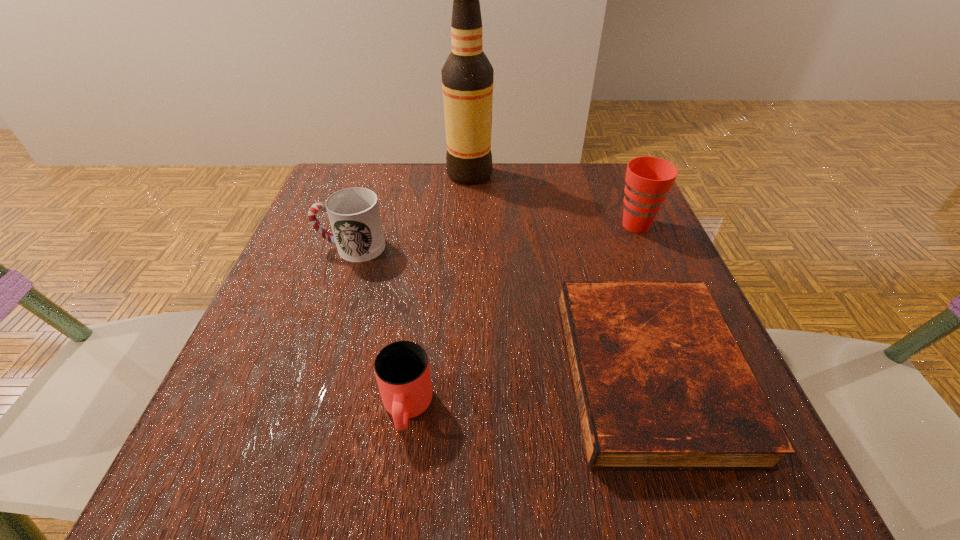
At what (x,y) coordinates should I click in order to perform the action: click on free space between the Bible and the farthest object. Please return your answer as a coordinate pair (x, y). Looking at the image, I should click on (560, 273).

Where is `empty space that is in between the fourth tallest object and the leftmost object`? This screenshot has height=540, width=960. empty space that is in between the fourth tallest object and the leftmost object is located at coordinates (379, 328).

What are the coordinates of `vacant point located between the rightmost cup and the second tallest cup` in the screenshot? It's located at (493, 236).

Identify the location of vacant point located between the alcohol and the second shortest object. (439, 292).

Choose which object is the second nearest neighbor to the Bible. Please provide its 2D coordinates. Your answer should be formatted as a tuple, i.e. [(x, y)], where the tuple contains the x and y coordinates of a point satisfying the conditions above.

[(402, 370)]

Identify which object is the fourth nearest to the tallest cup. Please provide its 2D coordinates. Your answer should be formatted as a tuple, i.e. [(x, y)], where the tuple contains the x and y coordinates of a point satisfying the conditions above.

[(402, 370)]

Where is `cup that stands as the second closest to the second cup from right to left`? The height and width of the screenshot is (540, 960). cup that stands as the second closest to the second cup from right to left is located at coordinates (648, 179).

Locate an element on the screen. The width and height of the screenshot is (960, 540). the third closest cup relative to the alcohol is located at coordinates (402, 370).

Identify the location of free space that satisfies the following two spatial constraints: 1. on the label of the tallest cup; 2. on the right side of the farthest object. Image resolution: width=960 pixels, height=540 pixels. (468, 225).

This screenshot has width=960, height=540. What are the coordinates of `vacant space that satisfies the following two spatial constraints: 1. on the label of the farthest object; 2. on the handle side of the second cup from right to left` in the screenshot? It's located at (462, 409).